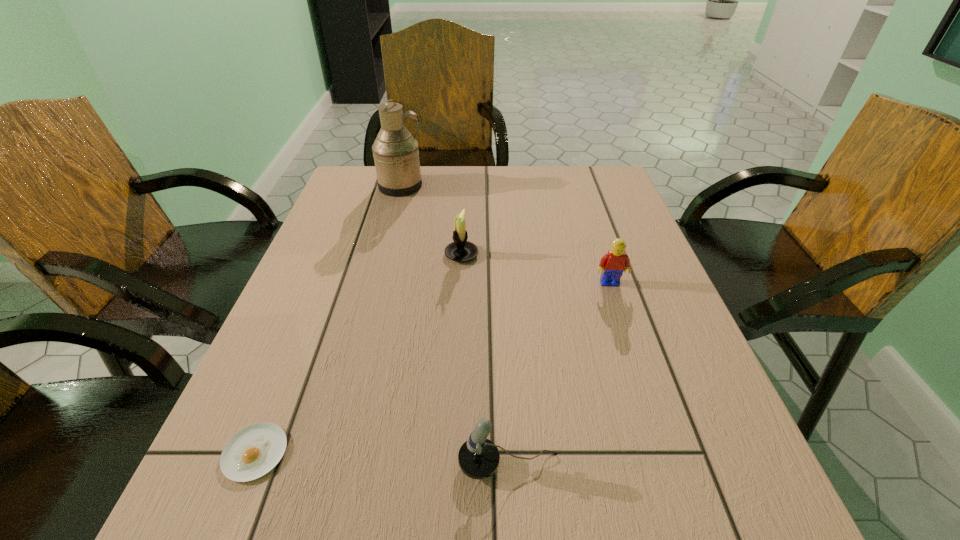
Find the location of a particular element. This screenshot has height=540, width=960. free space located on the right of the microphone is located at coordinates (692, 464).

Locate an element on the screen. vacant region located 0.310m on the back of the egg yolk is located at coordinates (319, 294).

Where is `object located in the far edge section of the desktop`? Image resolution: width=960 pixels, height=540 pixels. object located in the far edge section of the desktop is located at coordinates [x=396, y=156].

Locate an element on the screen. The height and width of the screenshot is (540, 960). pitcher that is at the left edge is located at coordinates (396, 156).

Locate an element on the screen. This screenshot has height=540, width=960. egg yolk present at the left edge is located at coordinates (251, 453).

This screenshot has width=960, height=540. Find the location of `object situated at the right edge`. object situated at the right edge is located at coordinates (613, 264).

Image resolution: width=960 pixels, height=540 pixels. I want to click on object positioned at the far left corner, so click(x=396, y=156).

This screenshot has width=960, height=540. In the image, there is a desktop. In order to click on vacant space at the far edge in this screenshot , I will do `click(443, 199)`.

Find the location of `vacant space at the near edge of the desktop`. vacant space at the near edge of the desktop is located at coordinates (586, 530).

Find the location of a particular element. The width and height of the screenshot is (960, 540). vacant region at the left edge of the desktop is located at coordinates (325, 443).